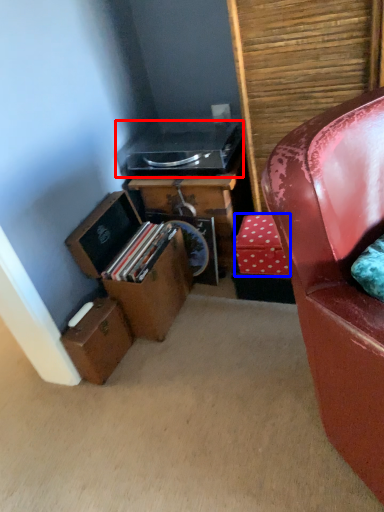
Question: Which of the following is the closest to the observer, stereo (highlighted by a red box) or cardboard box (highlighted by a blue box)?

Choices:
 (A) stereo
 (B) cardboard box

Answer: (B)